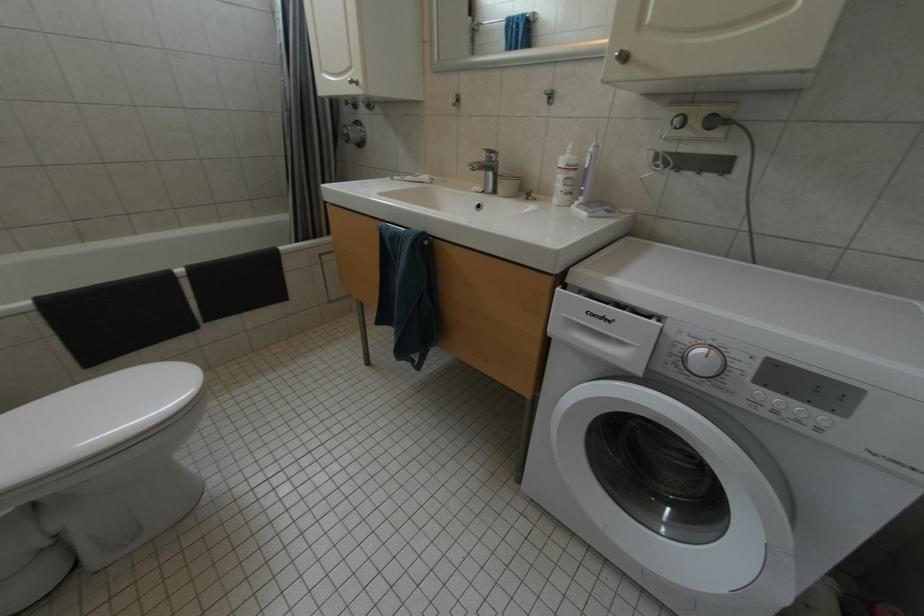
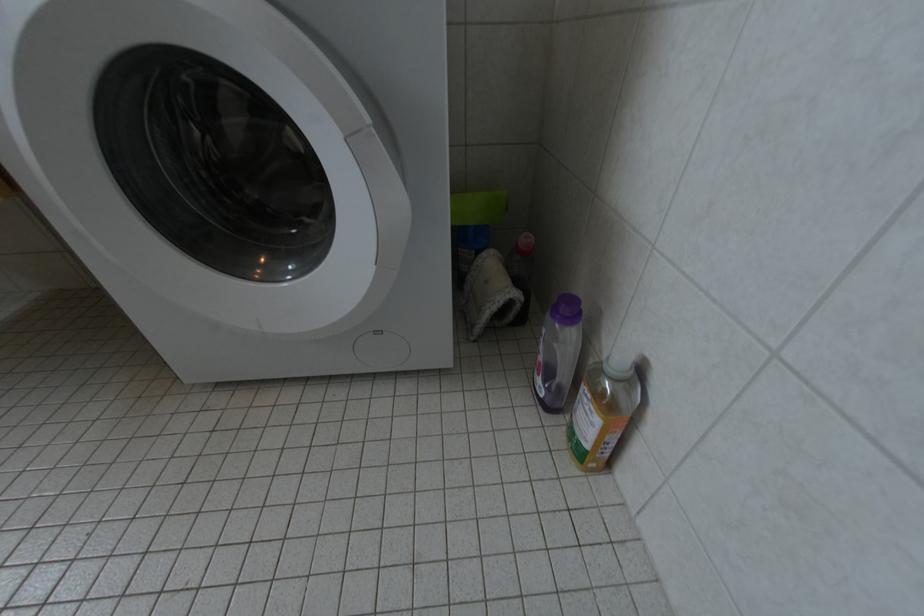
The images are taken continuously from a first-person perspective. In which direction is your viewpoint rotating?

The rotation direction of the camera is right-down.